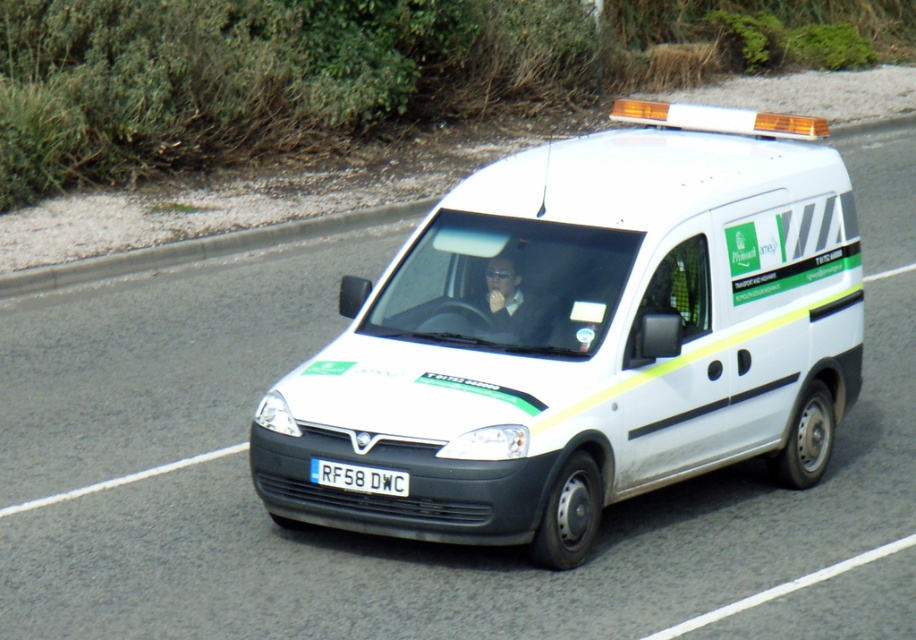
Who is positioned more to the right, white matte van at center or white plastic license plate at center?

From the viewer's perspective, white matte van at center appears more on the right side.

Between white matte van at center and white plastic license plate at center, which one is positioned lower?

white plastic license plate at center is below.

The width and height of the screenshot is (916, 640). What do you see at coordinates (586, 336) in the screenshot?
I see `white matte van at center` at bounding box center [586, 336].

Find the location of `white matte van at center`. white matte van at center is located at coordinates (586, 336).